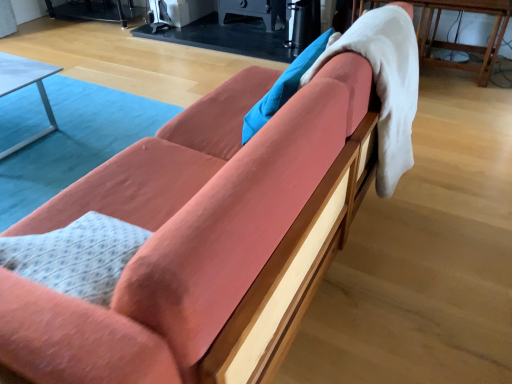
The width and height of the screenshot is (512, 384). Describe the element at coordinates (463, 44) in the screenshot. I see `wooden table at right, arranged as the 2th table when ordered from the bottom` at that location.

Measure the distance between point (372, 6) and camera.

Point (372, 6) is 2.80 meters from camera.

Where is `metallic silver table at left, which ranks as the first table in bottom-to-top order`? metallic silver table at left, which ranks as the first table in bottom-to-top order is located at coordinates (25, 86).

Identify the location of white fluffy blanket at upper right. [385, 83].

Can you confirm if wooden table at right, the 1th table viewed from the top, is taller than white fluffy blanket at upper right?

No.

From the image's perspective, is wooden table at right, the 2th table from the left, positioned above or below white fluffy blanket at upper right?

From the image's perspective, wooden table at right, the 2th table from the left, appears above white fluffy blanket at upper right.

Could you tell me if wooden table at right, the 1th table positioned from the right, is turned towards white fluffy blanket at upper right?

Yes, wooden table at right, the 1th table positioned from the right, is oriented towards white fluffy blanket at upper right.

Does point (407, 102) come closer to viewer compared to point (1, 88)?

That is True.

From the image's perspective, would you say white fluffy blanket at upper right is positioned over metallic silver table at left, placed as the 2th table when sorted from top to bottom?

Actually, white fluffy blanket at upper right appears below metallic silver table at left, placed as the 2th table when sorted from top to bottom, in the image.

Are white fluffy blanket at upper right and metallic silver table at left, the 1th table from the left, located far from each other?

Yes, white fluffy blanket at upper right and metallic silver table at left, the 1th table from the left, are located far from each other.

Which object is wider, white fluffy blanket at upper right or metallic silver table at left, which ranks as the first table in bottom-to-top order?

metallic silver table at left, which ranks as the first table in bottom-to-top order.

Is wooden table at right, arranged as the 2th table when ordered from the bottom, turned away from metallic silver table at left, which ranks as the second table in right-to-left order?

No.

Can you tell me how much wooden table at right, the 2th table from the left, and metallic silver table at left, the 1th table from the left, differ in facing direction?

There is a 88.8-degree angle between the facing directions of wooden table at right, the 2th table from the left, and metallic silver table at left, the 1th table from the left.

Does wooden table at right, the 1th table viewed from the top, have a greater width compared to metallic silver table at left, the 1th table from the left?

No, wooden table at right, the 1th table viewed from the top, is not wider than metallic silver table at left, the 1th table from the left.

Is the position of wooden table at right, the 1th table viewed from the top, more distant than that of metallic silver table at left, which ranks as the second table in right-to-left order?

Yes, wooden table at right, the 1th table viewed from the top, is further from the viewer.

Is metallic silver table at left, which ranks as the first table in bottom-to-top order, inside the boundaries of white fluffy blanket at upper right, or outside?

The correct answer is: outside.

Between metallic silver table at left, which ranks as the first table in bottom-to-top order, and white fluffy blanket at upper right, which one has smaller width?

white fluffy blanket at upper right is thinner.

Considering the points (10, 80) and (392, 193), which point is in front, point (10, 80) or point (392, 193)?

The point (392, 193) is closer to the camera.

Is metallic silver table at left, placed as the 2th table when sorted from top to bottom, shorter than wooden table at right, the 1th table positioned from the right?

Yes.

Locate an element on the screen. table behind the metallic silver table at left, the 1th table from the left is located at coordinates (463, 44).

Consider the image. From the image's perspective, is metallic silver table at left, which ranks as the first table in bottom-to-top order, on wooden table at right, the 2th table from the left?

No.

Measure the distance from white fluffy blanket at upper right to wooden table at right, the 2th table from the left.

A distance of 4.39 feet exists between white fluffy blanket at upper right and wooden table at right, the 2th table from the left.

Considering the relative sizes of white fluffy blanket at upper right and wooden table at right, the 1th table viewed from the top, in the image provided, is white fluffy blanket at upper right taller than wooden table at right, the 1th table viewed from the top,?

Indeed, white fluffy blanket at upper right has a greater height compared to wooden table at right, the 1th table viewed from the top.

In the scene shown: Between white fluffy blanket at upper right and wooden table at right, arranged as the 2th table when ordered from the bottom, which one is positioned in front?

white fluffy blanket at upper right is more forward.

In the image, is white fluffy blanket at upper right on the left side or the right side of wooden table at right, the 2th table from the left?

white fluffy blanket at upper right is to the left of wooden table at right, the 2th table from the left.

The image size is (512, 384). In order to click on blanket above the wooden table at right, the 2th table from the left (from a real-world perspective) in this screenshot , I will do `click(385, 83)`.

The width and height of the screenshot is (512, 384). Find the location of `table that appears on the left of white fluffy blanket at upper right`. table that appears on the left of white fluffy blanket at upper right is located at coordinates (25, 86).

When comparing their distances from white fluffy blanket at upper right, does wooden table at right, the 1th table viewed from the top, or metallic silver table at left, which ranks as the first table in bottom-to-top order, seem further?

metallic silver table at left, which ranks as the first table in bottom-to-top order, is further to white fluffy blanket at upper right.

In the scene shown: Considering their positions, is white fluffy blanket at upper right positioned closer to wooden table at right, the 2th table from the left, than metallic silver table at left, which ranks as the first table in bottom-to-top order?

white fluffy blanket at upper right is closer to wooden table at right, the 2th table from the left.

From the image, which object appears to be farther from metallic silver table at left, which ranks as the second table in right-to-left order, white fluffy blanket at upper right or wooden table at right, the 2th table from the left?

wooden table at right, the 2th table from the left, is further to metallic silver table at left, which ranks as the second table in right-to-left order.

Estimate the real-world distances between objects in this image. Which object is further from metallic silver table at left, the 1th table from the left, wooden table at right, the 1th table positioned from the right, or white fluffy blanket at upper right?

Among the two, wooden table at right, the 1th table positioned from the right, is located further to metallic silver table at left, the 1th table from the left.

Estimate the real-world distances between objects in this image. Which object is closer to wooden table at right, the 1th table positioned from the right, metallic silver table at left, the 1th table from the left, or white fluffy blanket at upper right?

The object closer to wooden table at right, the 1th table positioned from the right, is white fluffy blanket at upper right.

Based on their spatial positions, is metallic silver table at left, placed as the 2th table when sorted from top to bottom, or wooden table at right, arranged as the 2th table when ordered from the bottom, closer to white fluffy blanket at upper right?

wooden table at right, arranged as the 2th table when ordered from the bottom, lies closer to white fluffy blanket at upper right than the other object.

Where is `blanket situated between metallic silver table at left, which ranks as the second table in right-to-left order, and wooden table at right, the 2th table from the left, from left to right`? The width and height of the screenshot is (512, 384). blanket situated between metallic silver table at left, which ranks as the second table in right-to-left order, and wooden table at right, the 2th table from the left, from left to right is located at coordinates coord(385,83).